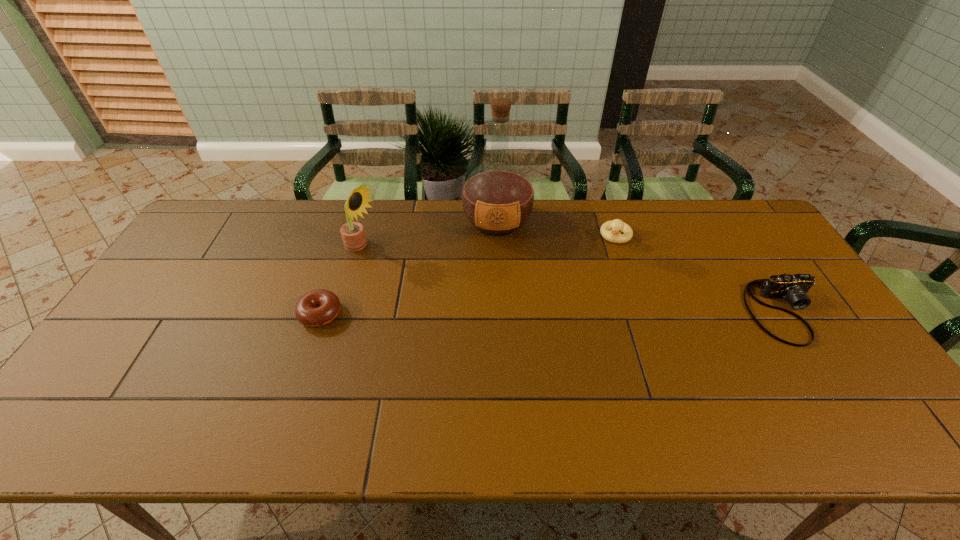
Where is `sunflower located at the far edge`? This screenshot has width=960, height=540. sunflower located at the far edge is located at coordinates (352, 233).

You are a GUI agent. You are given a task and a screenshot of the screen. Output one action in this format:
    pyautogui.click(x=<x>, y=<y>)
    Task: Click on the object at the right edge
    
    Given the screenshot: What is the action you would take?
    pos(793,288)

Where is `vacant space at the far edge of the desktop`? The height and width of the screenshot is (540, 960). vacant space at the far edge of the desktop is located at coordinates (597, 238).

Where is `free space at the near edge of the desktop`? Image resolution: width=960 pixels, height=540 pixels. free space at the near edge of the desktop is located at coordinates point(740,394).

This screenshot has width=960, height=540. I want to click on free space at the left edge of the desktop, so click(194, 287).

What are the coordinates of `free point at the far right corner` in the screenshot? It's located at [x=749, y=210].

At what (x,y) coordinates should I click in order to perform the action: click on free location at the near right corner. Please return your answer as a coordinate pair (x, y). Looking at the image, I should click on (870, 386).

At what (x,y) coordinates should I click in order to perform the action: click on vacant area between the duckling and the rightmost object. Please return your answer as a coordinate pair (x, y). The width and height of the screenshot is (960, 540). Looking at the image, I should click on (700, 274).

In order to click on vacant point located between the second tallest object and the fourth object from left to right in this screenshot , I will do `click(489, 242)`.

Where is `free space between the rightmost object and the shortest object`? This screenshot has height=540, width=960. free space between the rightmost object and the shortest object is located at coordinates (552, 313).